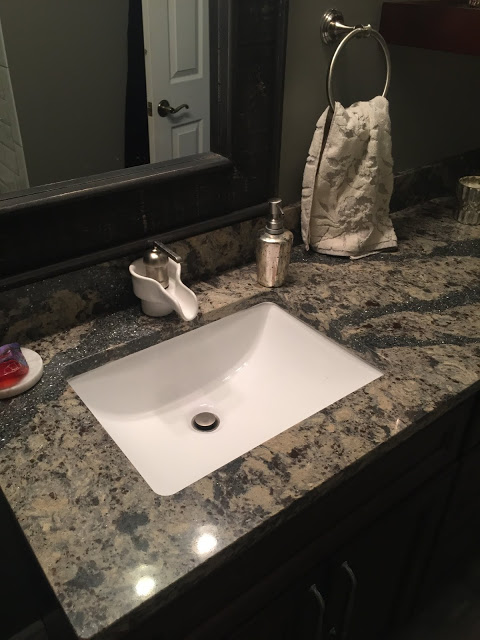
What are the coordinates of `wall` in the screenshot? It's located at (411, 84).